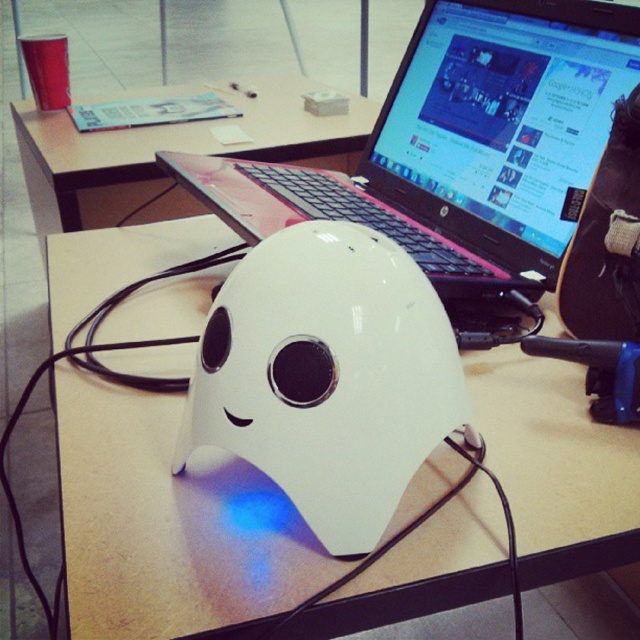
Locate an element on the screen. white glossy mask at center is located at coordinates (168, 525).

Who is positioned more to the left, white glossy mask at center or pink plastic laptop at center?

From the viewer's perspective, white glossy mask at center appears more on the left side.

Identify the location of white glossy mask at center. This screenshot has width=640, height=640. (168, 525).

Find the location of `white glossy mask at center`. white glossy mask at center is located at coordinates (168, 525).

In the scene shown: Measure the distance between white glossy mask at center and white glossy mouse at center.

A distance of 5.99 inches exists between white glossy mask at center and white glossy mouse at center.

Who is higher up, white glossy mask at center or white glossy mouse at center?

white glossy mask at center is higher up.

Where is `white glossy mask at center`? The width and height of the screenshot is (640, 640). white glossy mask at center is located at coordinates (168, 525).

I want to click on white glossy mask at center, so click(168, 525).

The image size is (640, 640). What do you see at coordinates (168, 525) in the screenshot?
I see `white glossy mask at center` at bounding box center [168, 525].

Is white glossy mask at center wider than white matte table at center?

No.

Is point (108, 541) positioned behind point (32, 128)?

No.

This screenshot has height=640, width=640. I want to click on white glossy mask at center, so click(168, 525).